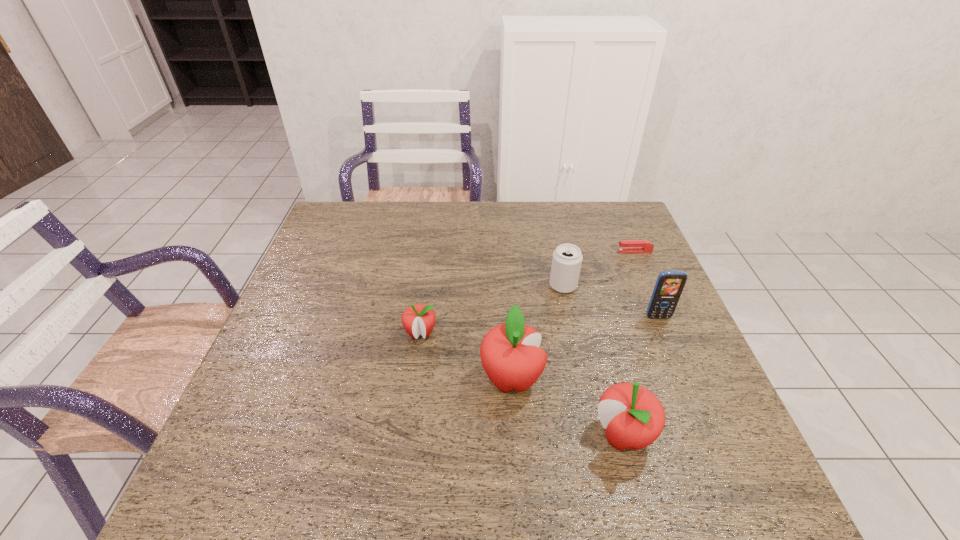
Locate an element on the screen. Image resolution: width=960 pixels, height=540 pixels. stapler present at the right edge is located at coordinates (626, 246).

Where is `cellular telephone present at the right edge`? cellular telephone present at the right edge is located at coordinates (669, 285).

In the image, there is a desktop. At what (x,y) coordinates should I click in order to perform the action: click on free space at the far edge. Please return your answer as a coordinate pair (x, y). The width and height of the screenshot is (960, 540). Looking at the image, I should click on (517, 237).

In the image, there is a desktop. Where is `vacant space at the near edge`? vacant space at the near edge is located at coordinates (395, 428).

The height and width of the screenshot is (540, 960). What are the coordinates of `vacant space at the left edge` in the screenshot? It's located at (305, 286).

The height and width of the screenshot is (540, 960). What are the coordinates of `free space at the right edge` in the screenshot? It's located at (693, 349).

The width and height of the screenshot is (960, 540). Find the location of `free spot at the far left corner of the desktop`. free spot at the far left corner of the desktop is located at coordinates (348, 217).

Where is `vacant space at the far right corner of the desktop`? Image resolution: width=960 pixels, height=540 pixels. vacant space at the far right corner of the desktop is located at coordinates (617, 205).

The image size is (960, 540). In the image, there is a desktop. Find the location of `vacant space at the near right corner`. vacant space at the near right corner is located at coordinates (672, 420).

Where is `unoccupied area between the shortest object and the fifth tallest object`? The height and width of the screenshot is (540, 960). unoccupied area between the shortest object and the fifth tallest object is located at coordinates (528, 292).